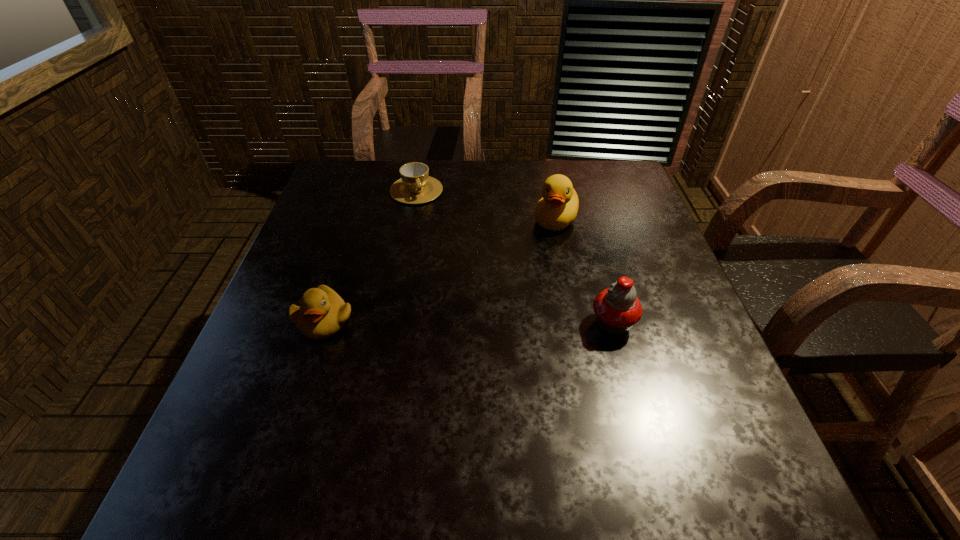
Where is `vacant space located with the handle on the side of the second object from left to right`? vacant space located with the handle on the side of the second object from left to right is located at coordinates (453, 279).

Identify the location of free space located at the beak of the duck. (518, 282).

Where is `vacant area situated 0.300m at the beak of the duck`? vacant area situated 0.300m at the beak of the duck is located at coordinates (496, 315).

This screenshot has width=960, height=540. I want to click on vacant space located 0.160m at the beak of the duck, so click(523, 274).

Locate an element on the screen. The image size is (960, 540). cup located in the far edge section of the desktop is located at coordinates (416, 186).

I want to click on duck located at the far edge, so tap(558, 207).

Locate an element on the screen. This screenshot has width=960, height=540. object that is at the left edge is located at coordinates (322, 313).

This screenshot has width=960, height=540. Find the location of `object that is at the right edge`. object that is at the right edge is located at coordinates (617, 308).

In the image, there is a desktop. Identify the location of blank space at the far edge. (487, 192).

I want to click on vacant space at the near edge of the desktop, so click(x=472, y=435).